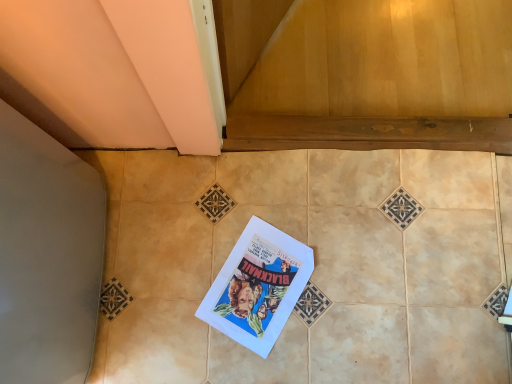
Where is `unoccupied space behind white paper comic book at center`? This screenshot has height=384, width=512. unoccupied space behind white paper comic book at center is located at coordinates (268, 201).